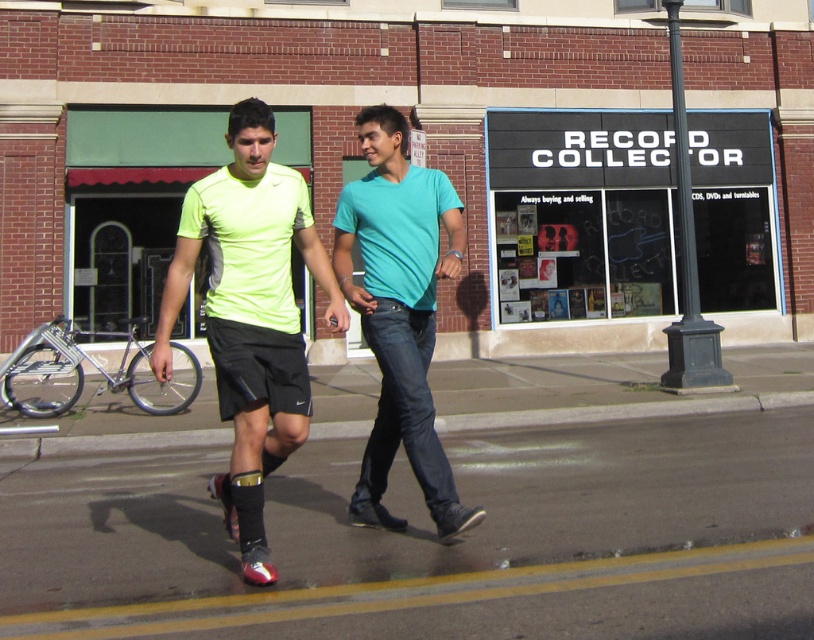
Question: Among these points, which one is nearest to the camera?

Choices:
 (A) (519, 176)
 (B) (211, 333)
 (C) (475, 524)

Answer: (B)

Question: Does black matte sign at upper center appear over teal matte shirt at center?

Choices:
 (A) no
 (B) yes

Answer: (B)

Question: Does smooth asphalt road at center have a lesser width compared to teal matte shirt at center?

Choices:
 (A) yes
 (B) no

Answer: (A)

Question: Is black matte sign at upper center below neon green fabric shirt at center?

Choices:
 (A) no
 (B) yes

Answer: (A)

Question: Which object appears closest to the camera in this image?

Choices:
 (A) smooth asphalt road at center
 (B) teal matte shirt at center
 (C) black matte sign at upper center

Answer: (B)

Question: Which point appears farthest from the camera in this image?

Choices:
 (A) (514, 435)
 (B) (362, 243)
 (C) (517, 241)
 (D) (248, 97)

Answer: (C)